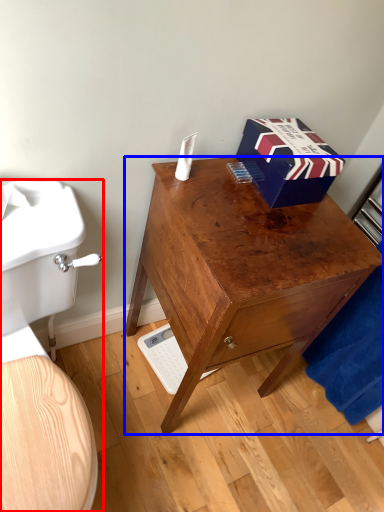
Question: Among these objects, which one is nearest to the camera, toilet (highlighted by a red box) or desk (highlighted by a blue box)?

Choices:
 (A) toilet
 (B) desk

Answer: (A)